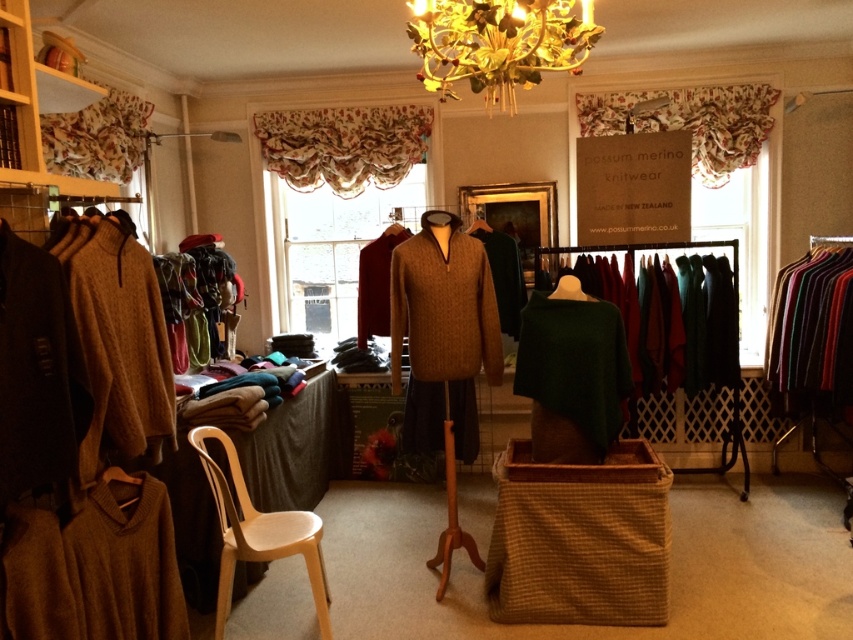
You are a customer in the boutique and want to choose between the knitted beige sweater at left and the green wool sweater at center. Which one is taller?

The knitted beige sweater at left is taller than the green wool sweater at center.

You are a customer browsing the boutique and want to compare the knitted beige sweater at left and the green wool sweater at center. Which one is located to the left of the other?

The knitted beige sweater at left is positioned on the left side of green wool sweater at center.